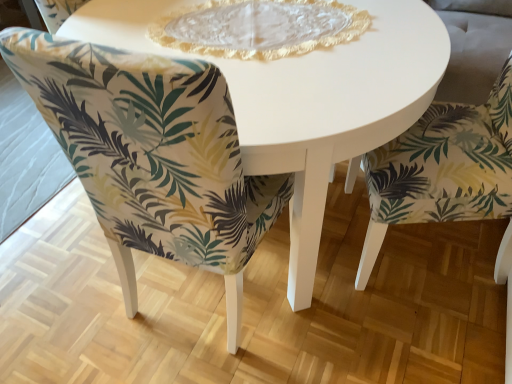
Question: Is green leaf-patterned fabric chair at center, which is counted as the second chair, starting from the right, closer to camera compared to green leaf-patterned fabric chair at lower right, the second chair positioned from the left?

Choices:
 (A) yes
 (B) no

Answer: (A)

Question: Considering the relative sizes of green leaf-patterned fabric chair at center, marked as the 1th chair in a left-to-right arrangement, and green leaf-patterned fabric chair at lower right, the second chair positioned from the left, in the image provided, is green leaf-patterned fabric chair at center, marked as the 1th chair in a left-to-right arrangement, bigger than green leaf-patterned fabric chair at lower right, the second chair positioned from the left,?

Choices:
 (A) yes
 (B) no

Answer: (A)

Question: Does green leaf-patterned fabric chair at center, marked as the 1th chair in a left-to-right arrangement, appear on the right side of green leaf-patterned fabric chair at lower right, which ranks as the first chair in right-to-left order?

Choices:
 (A) no
 (B) yes

Answer: (A)

Question: From a real-world perspective, is green leaf-patterned fabric chair at center, which is counted as the second chair, starting from the right, below green leaf-patterned fabric chair at lower right, which ranks as the first chair in right-to-left order?

Choices:
 (A) yes
 (B) no

Answer: (A)

Question: From a real-world perspective, is green leaf-patterned fabric chair at center, which is counted as the second chair, starting from the right, located higher than green leaf-patterned fabric chair at lower right, the second chair positioned from the left?

Choices:
 (A) yes
 (B) no

Answer: (B)

Question: From the image's perspective, is green leaf-patterned fabric chair at lower right, the second chair positioned from the left, positioned above or below white glossy table at center?

Choices:
 (A) below
 (B) above

Answer: (A)

Question: Would you say green leaf-patterned fabric chair at lower right, which ranks as the first chair in right-to-left order, is inside or outside white glossy table at center?

Choices:
 (A) inside
 (B) outside

Answer: (B)

Question: Is point (391, 142) closer or farther from the camera than point (316, 153)?

Choices:
 (A) farther
 (B) closer

Answer: (A)

Question: Considering the positions of green leaf-patterned fabric chair at lower right, the second chair positioned from the left, and white glossy table at center in the image, is green leaf-patterned fabric chair at lower right, the second chair positioned from the left, wider or thinner than white glossy table at center?

Choices:
 (A) thin
 (B) wide

Answer: (A)

Question: Is point (296, 296) closer or farther from the camera than point (478, 165)?

Choices:
 (A) closer
 (B) farther

Answer: (B)

Question: From their relative heights in the image, would you say white glossy table at center is taller or shorter than green leaf-patterned fabric chair at lower right, which ranks as the first chair in right-to-left order?

Choices:
 (A) short
 (B) tall

Answer: (A)

Question: Looking at the image, does white glossy table at center seem bigger or smaller compared to green leaf-patterned fabric chair at lower right, which ranks as the first chair in right-to-left order?

Choices:
 (A) small
 (B) big

Answer: (B)

Question: From a real-world perspective, is white glossy table at center physically located above or below green leaf-patterned fabric chair at lower right, the second chair positioned from the left?

Choices:
 (A) above
 (B) below

Answer: (B)

Question: From the image's perspective, is white glossy table at center positioned above or below green leaf-patterned fabric chair at center, marked as the 1th chair in a left-to-right arrangement?

Choices:
 (A) below
 (B) above

Answer: (B)

Question: In the image, is white glossy table at center positioned in front of or behind green leaf-patterned fabric chair at center, marked as the 1th chair in a left-to-right arrangement?

Choices:
 (A) behind
 (B) front

Answer: (A)